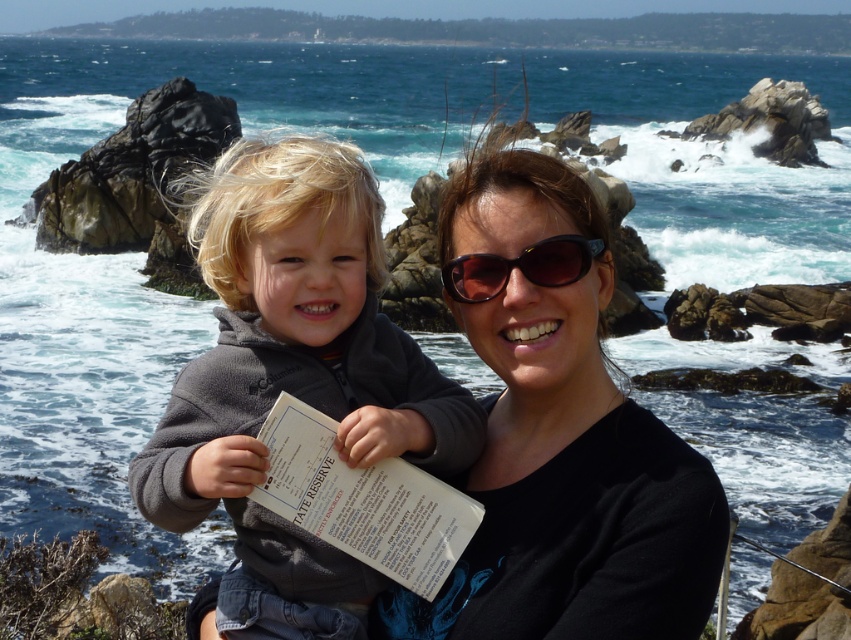
Question: Which point is closer to the camera?

Choices:
 (A) (458, 284)
 (B) (570, 237)

Answer: (B)

Question: Does gray fleece jacket at left appear under black plastic sunglasses at center?

Choices:
 (A) yes
 (B) no

Answer: (A)

Question: Among these objects, which one is nearest to the camera?

Choices:
 (A) gray fleece jacket at left
 (B) black matte sunglasses at upper center
 (C) black plastic sunglasses at center

Answer: (B)

Question: Which object appears farthest from the camera in this image?

Choices:
 (A) gray fleece jacket at left
 (B) black plastic sunglasses at center

Answer: (B)

Question: Does black matte sunglasses at upper center have a larger size compared to gray fleece jacket at left?

Choices:
 (A) no
 (B) yes

Answer: (B)

Question: In this image, where is black matte sunglasses at upper center located relative to black plastic sunglasses at center?

Choices:
 (A) below
 (B) above

Answer: (A)